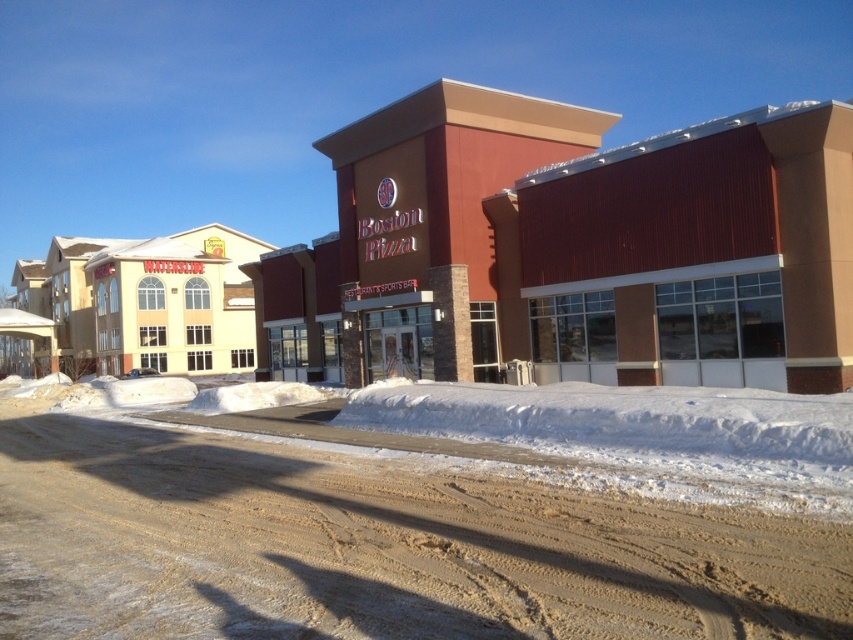
Question: Is matte brick building at center below brown sandy dirt track at lower center?

Choices:
 (A) yes
 (B) no

Answer: (B)

Question: Among these points, which one is nearest to the camera?

Choices:
 (A) (218, 451)
 (B) (822, 316)

Answer: (A)

Question: Is the position of matte brick building at center more distant than that of brown sandy dirt track at lower center?

Choices:
 (A) yes
 (B) no

Answer: (A)

Question: Does matte brick building at center appear over brown sandy dirt track at lower center?

Choices:
 (A) yes
 (B) no

Answer: (A)